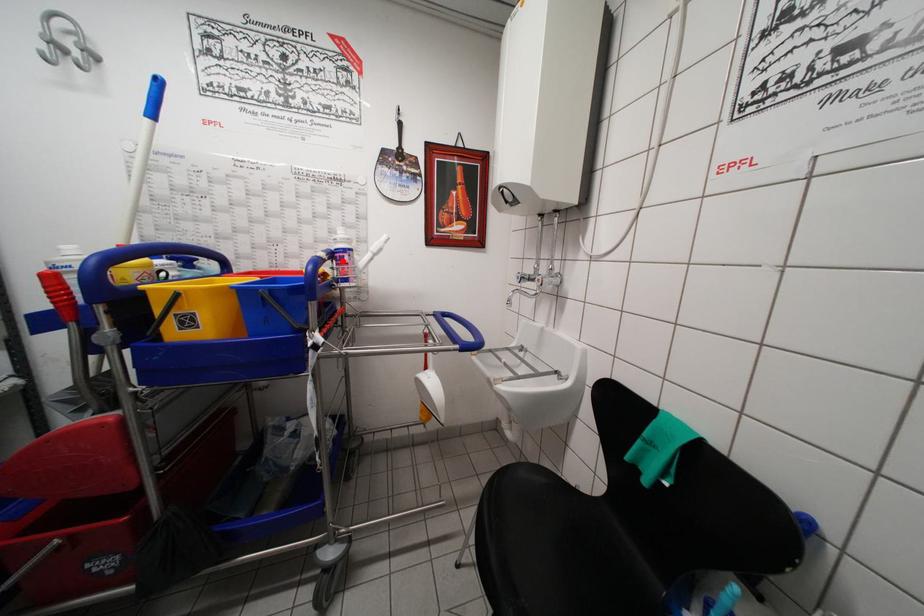
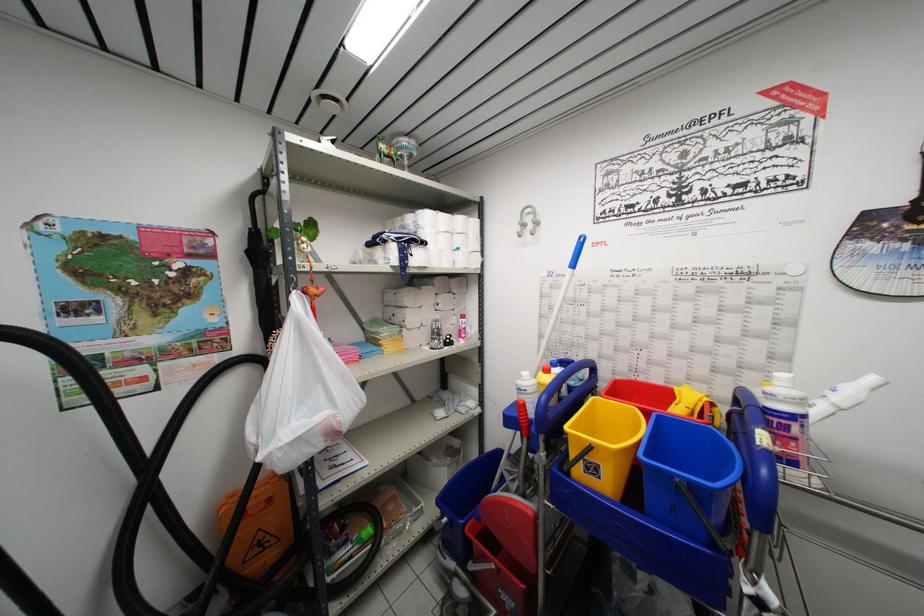
Question: I am providing you with two images of the same scene from different viewpoints. A red point is marked on the first image. Is the red point's position out of view in image 2?

Choices:
 (A) Yes
 (B) No

Answer: (B)